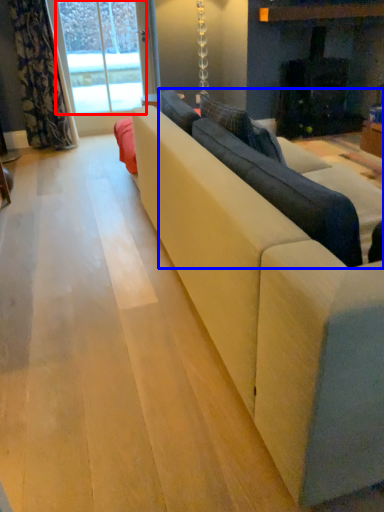
Question: Which point is further to the camera, window screen (highlighted by a red box) or couch (highlighted by a blue box)?

Choices:
 (A) window screen
 (B) couch

Answer: (A)